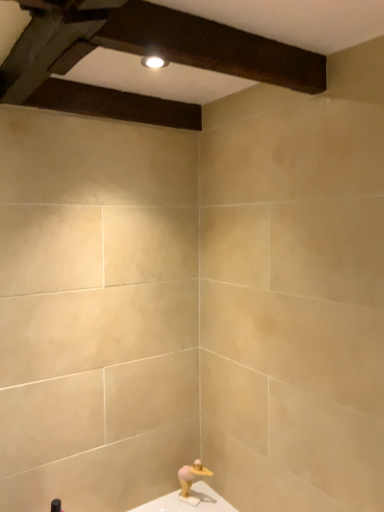
Describe the element at coordinates (191, 476) in the screenshot. I see `pink matte sculpture at lower center` at that location.

Locate an element on the screen. This screenshot has width=384, height=512. pink matte sculpture at lower center is located at coordinates (191, 476).

Locate an element on the screen. dark brown wood at upper center is located at coordinates (114, 104).

The image size is (384, 512). What do you see at coordinates (114, 104) in the screenshot? I see `dark brown wood at upper center` at bounding box center [114, 104].

In order to face dark brown wood at upper center, should I rotate leftwards or rightwards?

Turn left by 10.618 degrees to look at dark brown wood at upper center.

At what (x,y) coordinates should I click in order to perform the action: click on pink matte sculpture at lower center. Please return your answer as a coordinate pair (x, y). Looking at the image, I should click on (191, 476).

Between pink matte sculpture at lower center and dark brown wood at upper center, which one appears on the right side from the viewer's perspective?

pink matte sculpture at lower center is more to the right.

Considering the positions of objects pink matte sculpture at lower center and dark brown wood at upper center in the image provided, who is in front, pink matte sculpture at lower center or dark brown wood at upper center?

Positioned in front is dark brown wood at upper center.

Considering the positions of points (198, 459) and (129, 93), is point (198, 459) farther from camera compared to point (129, 93)?

That is True.

From the image's perspective, is pink matte sculpture at lower center on dark brown wood at upper center?

Incorrect, from the image's perspective, pink matte sculpture at lower center is lower than dark brown wood at upper center.

From a real-world perspective, relative to dark brown wood at upper center, is pink matte sculpture at lower center vertically above or below?

pink matte sculpture at lower center is situated lower than dark brown wood at upper center in the real world.

Is pink matte sculpture at lower center thinner than dark brown wood at upper center?

Yes, pink matte sculpture at lower center is thinner than dark brown wood at upper center.

Considering the relative sizes of pink matte sculpture at lower center and dark brown wood at upper center in the image provided, is pink matte sculpture at lower center shorter than dark brown wood at upper center?

No, pink matte sculpture at lower center is not shorter than dark brown wood at upper center.

Considering the relative sizes of pink matte sculpture at lower center and dark brown wood at upper center in the image provided, is pink matte sculpture at lower center smaller than dark brown wood at upper center?

Yes.

Would you say pink matte sculpture at lower center contains dark brown wood at upper center?

→ No, dark brown wood at upper center is not surrounded by pink matte sculpture at lower center.

Is pink matte sculpture at lower center directly adjacent to dark brown wood at upper center?

No, pink matte sculpture at lower center is not next to dark brown wood at upper center.

Could you tell me if pink matte sculpture at lower center is turned towards dark brown wood at upper center?

No.

In the scene shown: What's the angular difference between pink matte sculpture at lower center and dark brown wood at upper center's facing directions?

There is a 28.7-degree angle between the facing directions of pink matte sculpture at lower center and dark brown wood at upper center.

This screenshot has height=512, width=384. Find the location of `plank that is on the left side of pink matte sculpture at lower center`. plank that is on the left side of pink matte sculpture at lower center is located at coordinates (114, 104).

Considering the positions of objects dark brown wood at upper center and pink matte sculpture at lower center in the image provided, who is more to the left, dark brown wood at upper center or pink matte sculpture at lower center?

dark brown wood at upper center.

Which object is more forward, dark brown wood at upper center or pink matte sculpture at lower center?

dark brown wood at upper center is more forward.

Is point (150, 110) closer to viewer compared to point (180, 477)?

Yes.

From the image's perspective, which is below, dark brown wood at upper center or pink matte sculpture at lower center?

From the image's view, pink matte sculpture at lower center is below.

From a real-world perspective, is dark brown wood at upper center on pink matte sculpture at lower center?

Yes.

In terms of width, does dark brown wood at upper center look wider or thinner when compared to pink matte sculpture at lower center?

dark brown wood at upper center is wider than pink matte sculpture at lower center.

Considering the relative sizes of dark brown wood at upper center and pink matte sculpture at lower center in the image provided, is dark brown wood at upper center shorter than pink matte sculpture at lower center?

Yes, dark brown wood at upper center is shorter than pink matte sculpture at lower center.

From the picture: Between dark brown wood at upper center and pink matte sculpture at lower center, which one has smaller size?

Smaller between the two is pink matte sculpture at lower center.

Looking at this image, would you say dark brown wood at upper center is outside pink matte sculpture at lower center?

Yes, dark brown wood at upper center is located beyond the bounds of pink matte sculpture at lower center.

Is dark brown wood at upper center with pink matte sculpture at lower center?

dark brown wood at upper center is not next to pink matte sculpture at lower center, and they're not touching.

Is pink matte sculpture at lower center at the back of dark brown wood at upper center?

dark brown wood at upper center does not have its back to pink matte sculpture at lower center.

Measure the distance between dark brown wood at upper center and pink matte sculpture at lower center.

They are 4.65 feet apart.

This screenshot has height=512, width=384. What are the coordinates of `plank positioned vertically above the pink matte sculpture at lower center (from a real-world perspective)` in the screenshot? It's located at (114, 104).

Identify the location of plank in front of the pink matte sculpture at lower center. This screenshot has height=512, width=384. (114, 104).

Where is `plank on the left of pink matte sculpture at lower center`? plank on the left of pink matte sculpture at lower center is located at coordinates (114, 104).